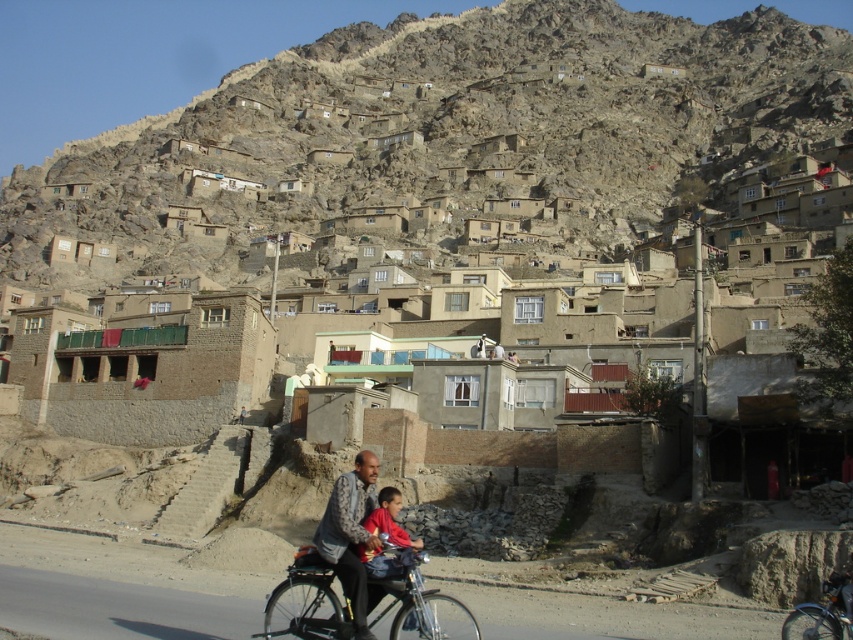
Is rugged stone mountain at upper center to the right of silver metallic bicycle at lower right from the viewer's perspective?

In fact, rugged stone mountain at upper center is to the left of silver metallic bicycle at lower right.

Between point (263, 100) and point (795, 636), which one is positioned in front?

Point (795, 636)

You are a GUI agent. You are given a task and a screenshot of the screen. Output one action in this format:
    pyautogui.click(x=<x>, y=<y>)
    Task: Click on the rugged stone mountain at upper center
    The image size is (853, 640).
    Given the screenshot: What is the action you would take?
    pyautogui.click(x=445, y=131)

Is rugged stone mountain at upper center thinner than red cotton shirt at center?

A: No.

Find the location of a particular element. Image resolution: width=853 pixels, height=640 pixels. rugged stone mountain at upper center is located at coordinates (445, 131).

In order to click on rugged stone mountain at upper center in this screenshot , I will do `click(445, 131)`.

Identify the location of rugged stone mountain at upper center. (445, 131).

Can you confirm if rugged stone mountain at upper center is shorter than metallic bicycle at center?

No.

Who is more forward, (201, 232) or (468, 624)?

Positioned in front is point (468, 624).

Find the location of a particular element. The image size is (853, 640). rugged stone mountain at upper center is located at coordinates (445, 131).